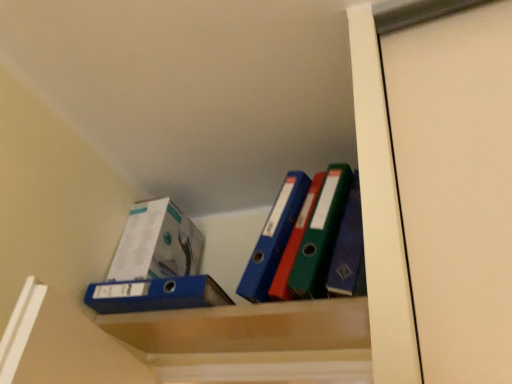
Question: Is blue matte folder at center bigger or smaller than matte plastic cabinet at center?

Choices:
 (A) small
 (B) big

Answer: (B)

Question: In terms of width, does blue matte folder at center look wider or thinner when compared to matte plastic cabinet at center?

Choices:
 (A) thin
 (B) wide

Answer: (B)

Question: Estimate the real-world distances between objects in this image. Which object is farther from the matte plastic cabinet at center?

Choices:
 (A) blue matte folder at center
 (B) white glossy box at upper left

Answer: (B)

Question: Which of these objects is positioned farthest from the matte plastic cabinet at center?

Choices:
 (A) blue matte folder at center
 (B) white glossy box at upper left

Answer: (B)